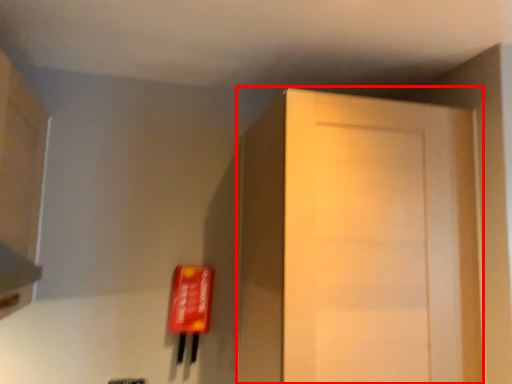
Question: From the image's perspective, what is the correct spatial positioning of door (annotated by the red box) in reference to cabinetry?

Choices:
 (A) below
 (B) above

Answer: (A)